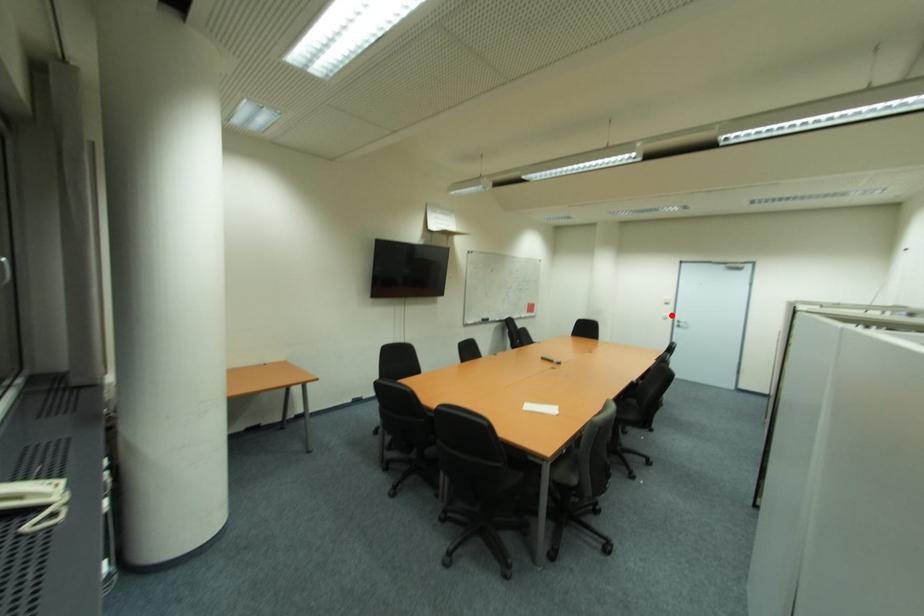
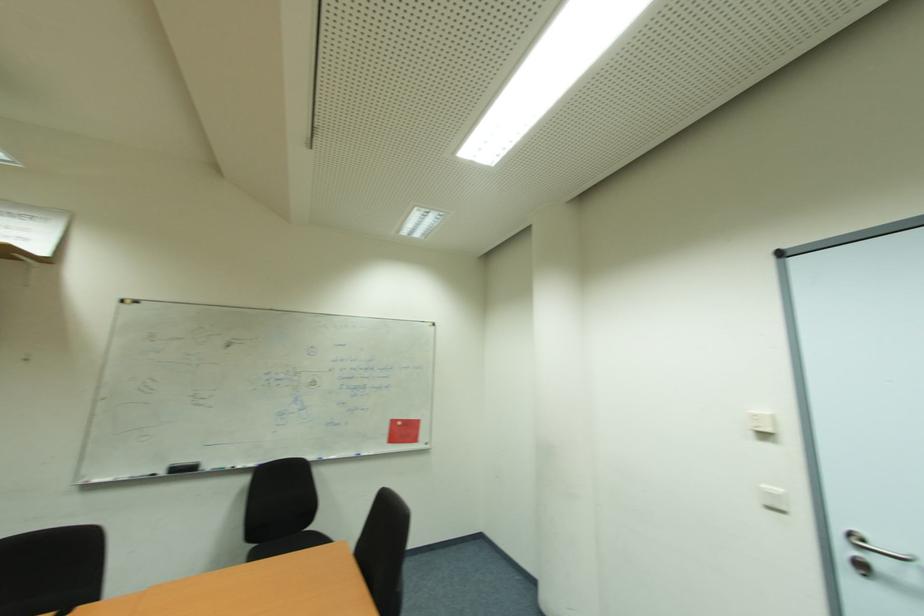
Find the pixel in the second image that matches the highlighted location in the first image.

(784, 492)